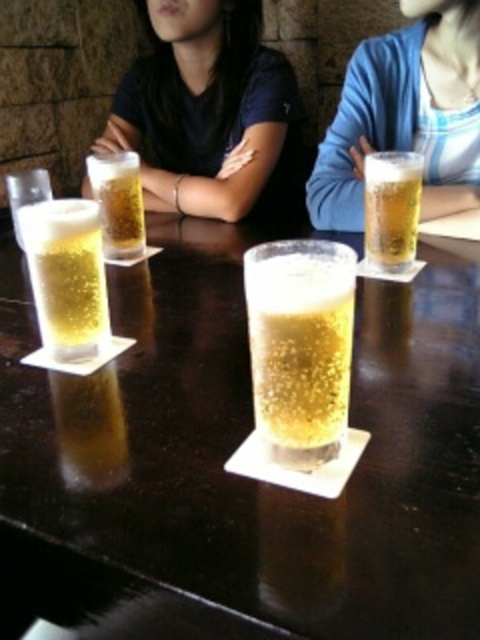
Between point (457, 13) and point (78, 244), which one is positioned behind?

Point (457, 13)

Describe the element at coordinates (407, 115) in the screenshot. Image resolution: width=480 pixels, height=640 pixels. I see `blue cotton sweater at upper center` at that location.

Identify the location of blue cotton sweater at upper center. Image resolution: width=480 pixels, height=640 pixels. (407, 115).

Can you confirm if clear glass beer at center is taller than blue cotton sweater at upper center?

Incorrect, clear glass beer at center's height is not larger of blue cotton sweater at upper center's.

Does clear glass beer at center have a larger size compared to blue cotton sweater at upper center?

Correct, clear glass beer at center is larger in size than blue cotton sweater at upper center.

What do you see at coordinates (245, 435) in the screenshot?
I see `clear glass beer at center` at bounding box center [245, 435].

Identify the location of clear glass beer at center. (245, 435).

Measure the distance between matte black shirt at upper center and camera.

They are 4.39 feet apart.

Is matte black shirt at upper center below translucent glass beer at right?

Incorrect, matte black shirt at upper center is not positioned below translucent glass beer at right.

The image size is (480, 640). What do you see at coordinates (208, 112) in the screenshot? I see `matte black shirt at upper center` at bounding box center [208, 112].

In order to click on matte black shirt at upper center in this screenshot , I will do `click(208, 112)`.